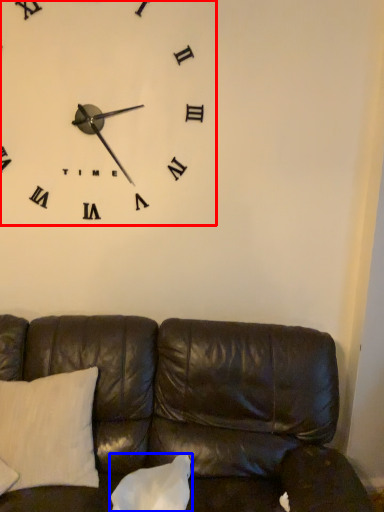
Question: Which object appears farthest to the camera in this image, wall clock (highlighted by a red box) or pillow (highlighted by a blue box)?

Choices:
 (A) wall clock
 (B) pillow

Answer: (A)